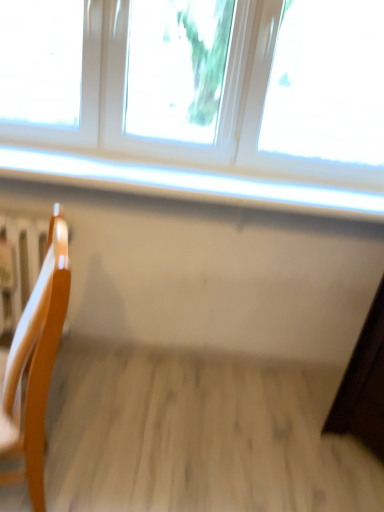
Question: From the image's perspective, is white glossy window sill at upper center beneath light wood chair at left?

Choices:
 (A) no
 (B) yes

Answer: (A)

Question: Is white glossy window sill at upper center touching light wood chair at left?

Choices:
 (A) no
 (B) yes

Answer: (A)

Question: Does white glossy window sill at upper center have a lesser width compared to light wood chair at left?

Choices:
 (A) yes
 (B) no

Answer: (B)

Question: Is white glossy window sill at upper center further to camera compared to light wood chair at left?

Choices:
 (A) no
 (B) yes

Answer: (B)

Question: Does white glossy window sill at upper center have a greater height compared to light wood chair at left?

Choices:
 (A) yes
 (B) no

Answer: (B)

Question: Does point (18, 30) appear closer or farther from the camera than point (39, 376)?

Choices:
 (A) closer
 (B) farther

Answer: (B)

Question: Relative to light wood chair at left, is white plastic window at upper center in front or behind?

Choices:
 (A) behind
 (B) front

Answer: (A)

Question: Would you say white plastic window at upper center is inside or outside light wood chair at left?

Choices:
 (A) inside
 (B) outside

Answer: (B)

Question: Based on their sizes in the image, would you say white plastic window at upper center is bigger or smaller than light wood chair at left?

Choices:
 (A) big
 (B) small

Answer: (A)

Question: In terms of size, does white glossy window sill at upper center appear bigger or smaller than wooden radiator at left?

Choices:
 (A) small
 (B) big

Answer: (A)

Question: From a real-world perspective, is white glossy window sill at upper center above or below wooden radiator at left?

Choices:
 (A) below
 (B) above

Answer: (B)

Question: Is white glossy window sill at upper center taller or shorter than wooden radiator at left?

Choices:
 (A) tall
 (B) short

Answer: (B)

Question: Which is correct: white glossy window sill at upper center is inside wooden radiator at left, or outside of it?

Choices:
 (A) outside
 (B) inside

Answer: (A)

Question: Which is correct: light wood chair at left is inside white glossy window sill at upper center, or outside of it?

Choices:
 (A) outside
 (B) inside

Answer: (A)

Question: From the image's perspective, relative to white glossy window sill at upper center, is light wood chair at left above or below?

Choices:
 (A) above
 (B) below

Answer: (B)